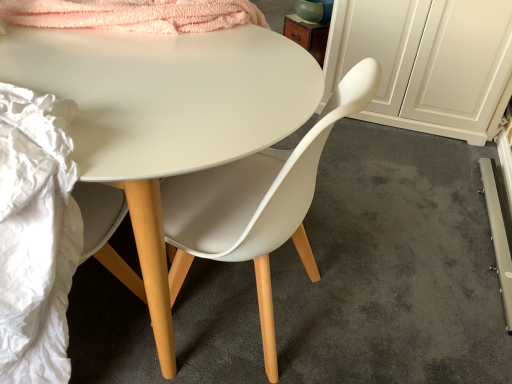
I want to click on free space in front of white matte cabinet at right, so click(x=407, y=172).